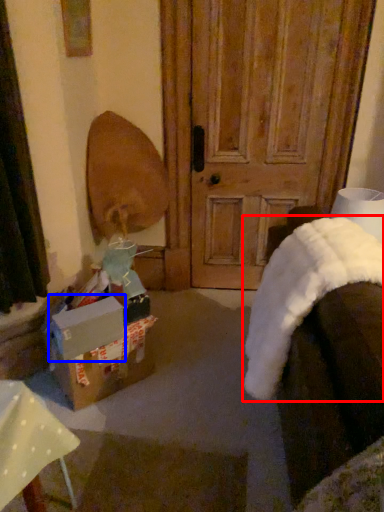
Question: Which of the following is the closest to the observer, blanket (highlighted by a red box) or cardboard box (highlighted by a blue box)?

Choices:
 (A) blanket
 (B) cardboard box

Answer: (A)